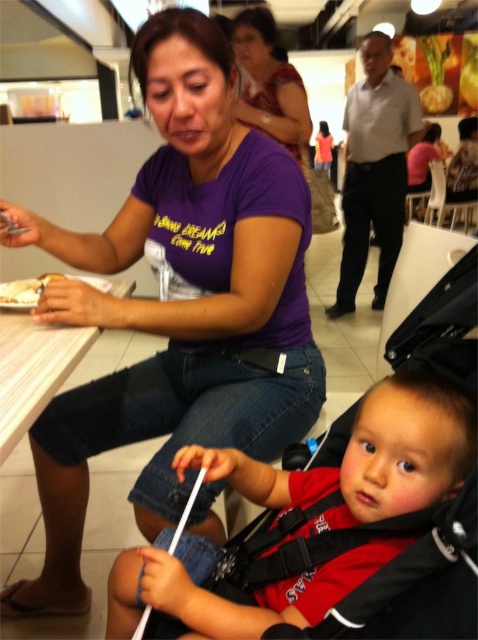
Consider the image. You are a photographer trying to capture a candid shot of the scene. You want to ensure that both the red fabric shirt at lower center and the white wood table at lower left are visible in your frame. Based on their positions, which object should you position closer to the left side of your camera viewfinder to include both?

To include both the red fabric shirt at lower center and the white wood table at lower left in the frame, position the white wood table at lower left closer to the left side of the camera viewfinder since the red fabric shirt at lower center is to the right of the white wood table at lower left.

You are a food delivery person who needs to place a hot meal on the table. The red fabric shirt at lower center is in the way. Can you slide the meal to the white matte plate at lower left without moving the shirt?

The red fabric shirt at lower center is closer to the viewer than the white matte plate at lower left, so you can slide the meal towards the white matte plate at lower left as the shirt is in front, but you need to ensure there is enough space between them to avoid contact.

You are a photographer trying to capture a candid shot of the scene. You notice the red fabric shirt at lower center and the white wood table at lower left. Which object is taller in the image?

The red fabric shirt at lower center is taller than the white wood table at lower left according to the description.